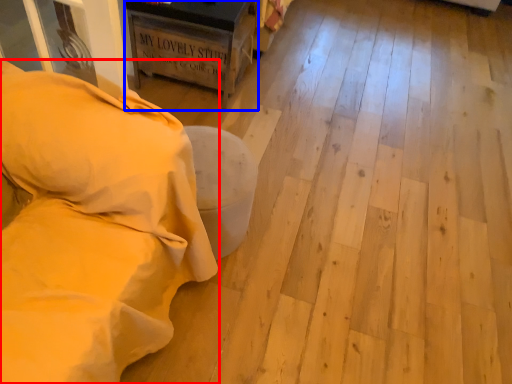
Question: Which object appears farthest to the camera in this image, furniture (highlighted by a red box) or furniture (highlighted by a blue box)?

Choices:
 (A) furniture
 (B) furniture

Answer: (B)